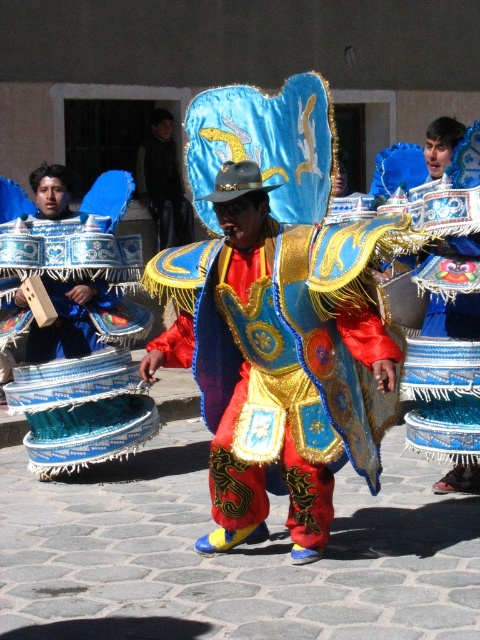
Question: Can you confirm if blue woven basket at left is bigger than velvet blue cape at center?

Choices:
 (A) no
 (B) yes

Answer: (B)

Question: Does shiny metallic armor at center have a smaller size compared to blue woven basket at left?

Choices:
 (A) no
 (B) yes

Answer: (A)

Question: Which object is closer to the camera taking this photo?

Choices:
 (A) shiny metallic armor at center
 (B) blue woven basket at left
 (C) velvet blue cape at center

Answer: (A)

Question: Does shiny metallic armor at center have a greater width compared to velvet blue cape at center?

Choices:
 (A) no
 (B) yes

Answer: (B)

Question: Which of the following is the closest to the observer?

Choices:
 (A) shiny metallic armor at center
 (B) blue woven basket at left
 (C) velvet blue cape at center

Answer: (A)

Question: Which object is the farthest from the blue woven basket at left?

Choices:
 (A) shiny metallic armor at center
 (B) velvet blue cape at center

Answer: (B)